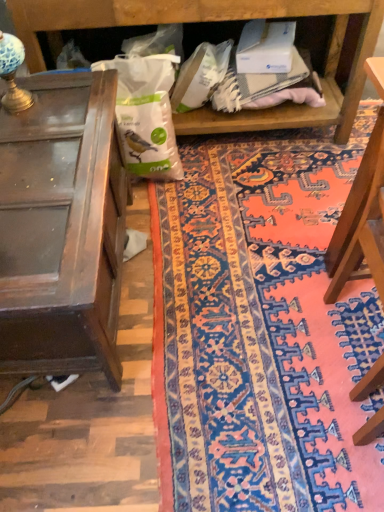
At what (x,y) coordinates should I click in order to perform the action: click on vacant space that's between wooden table at left and wooden chair at right. Please return your answer as a coordinate pair (x, y). Looking at the image, I should click on (218, 300).